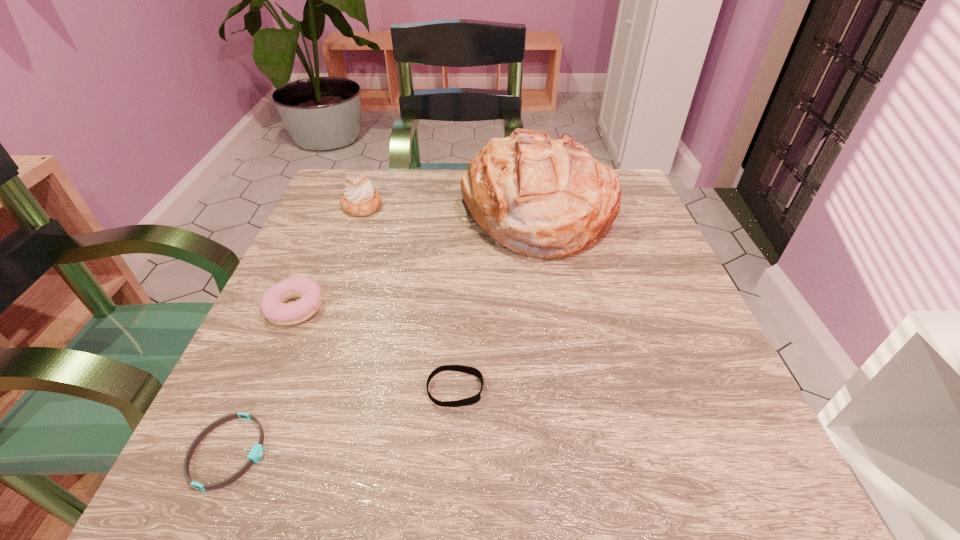
Select which object appears as the second closest to the bread. Please provide its 2D coordinates. Your answer should be formatted as a tuple, i.e. [(x, y)], where the tuple contains the x and y coordinates of a point satisfying the conditions above.

[(272, 305)]

In order to click on free space in the image that satisfies the following two spatial constraints: 1. on the front side of the fourth shortest object; 2. on the buckle of the shortest object in this screenshot , I will do [274, 452].

You are a GUI agent. You are given a task and a screenshot of the screen. Output one action in this format:
    pyautogui.click(x=<x>, y=<y>)
    Task: Click on the free space that satisfies the following two spatial constraints: 1. on the front side of the pastry; 2. on the buckle of the left wristband
    The image size is (960, 540).
    Given the screenshot: What is the action you would take?
    pyautogui.click(x=274, y=452)